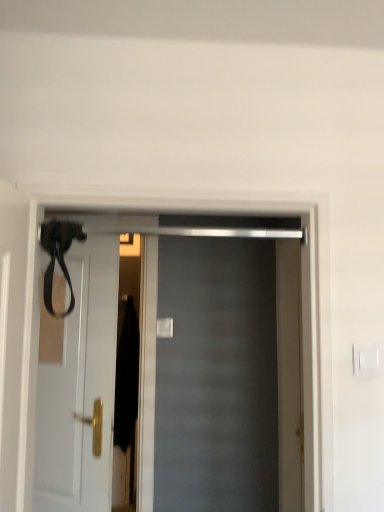
Find the location of a particular element. white matte door at left, which ranks as the second door in front-to-back order is located at coordinates (80, 388).

Measure the distance between point (74, 454) and camera.

Point (74, 454) and camera are 1.77 meters apart from each other.

Describe the element at coordinates (80, 388) in the screenshot. I see `white matte door at left, placed as the 1th door when sorted from left to right` at that location.

The height and width of the screenshot is (512, 384). What do you see at coordinates (178, 369) in the screenshot? I see `matte black door at center, which is counted as the second door, starting from the left` at bounding box center [178, 369].

Locate an element on the screen. Image resolution: width=384 pixels, height=512 pixels. matte black door at center, which is counted as the second door, starting from the left is located at coordinates (178, 369).

Locate an element on the screen. white matte door at left, the 1th door when ordered from back to front is located at coordinates (80, 388).

Between white matte door at left, placed as the 1th door when sorted from left to right, and matte black door at center, which is counted as the second door, starting from the left, which one appears on the right side from the viewer's perspective?

From the viewer's perspective, matte black door at center, which is counted as the second door, starting from the left, appears more on the right side.

Is white matte door at left, placed as the 1th door when sorted from left to right, closer to camera compared to matte black door at center, which is counted as the second door, starting from the left?

No, white matte door at left, placed as the 1th door when sorted from left to right, is behind matte black door at center, which is counted as the second door, starting from the left.

Considering the positions of point (110, 330) and point (99, 406), is point (110, 330) closer or farther from the camera than point (99, 406)?

Clearly, point (110, 330) is more distant from the camera than point (99, 406).

From the image's perspective, does white matte door at left, placed as the 1th door when sorted from left to right, appear lower than matte black door at center, positioned as the 1th door in front-to-back order?

Yes.

From a real-world perspective, is white matte door at left, the 1th door when ordered from back to front, above or below matte black door at center, positioned as the 1th door in front-to-back order?

From a real-world perspective, white matte door at left, the 1th door when ordered from back to front, is physically below matte black door at center, positioned as the 1th door in front-to-back order.

In the scene shown: Which of these two, white matte door at left, placed as the 1th door when sorted from left to right, or matte black door at center, arranged as the 2th door when viewed from the back, is thinner?

white matte door at left, placed as the 1th door when sorted from left to right, is thinner.

Considering the sizes of objects white matte door at left, placed as the 1th door when sorted from left to right, and matte black door at center, positioned as the 1th door in front-to-back order, in the image provided, who is taller, white matte door at left, placed as the 1th door when sorted from left to right, or matte black door at center, positioned as the 1th door in front-to-back order,?

With more height is white matte door at left, placed as the 1th door when sorted from left to right.

Considering the sizes of objects white matte door at left, the 1th door when ordered from back to front, and matte black door at center, which is the 1th door in right-to-left order, in the image provided, who is bigger, white matte door at left, the 1th door when ordered from back to front, or matte black door at center, which is the 1th door in right-to-left order,?

matte black door at center, which is the 1th door in right-to-left order.

From the picture: Can matte black door at center, which is counted as the second door, starting from the left, be found inside white matte door at left, placed as the 1th door when sorted from left to right?

That's incorrect, matte black door at center, which is counted as the second door, starting from the left, is not inside white matte door at left, placed as the 1th door when sorted from left to right.

Is white matte door at left, marked as the 2th door in a right-to-left arrangement, with matte black door at center, arranged as the 2th door when viewed from the back?

No, white matte door at left, marked as the 2th door in a right-to-left arrangement, is not beside matte black door at center, arranged as the 2th door when viewed from the back.

Could you tell me if white matte door at left, marked as the 2th door in a right-to-left arrangement, is facing matte black door at center, which is the 1th door in right-to-left order?

No, white matte door at left, marked as the 2th door in a right-to-left arrangement, does not turn towards matte black door at center, which is the 1th door in right-to-left order.

You are a GUI agent. You are given a task and a screenshot of the screen. Output one action in this format:
    pyautogui.click(x=<x>, y=<y>)
    Task: Click on the door above the white matte door at left, the 1th door when ordered from back to front (from a real-world perspective)
    
    Given the screenshot: What is the action you would take?
    pyautogui.click(x=178, y=369)

In the image, is matte black door at center, which is counted as the second door, starting from the left, on the left side or the right side of white matte door at left, which ranks as the second door in front-to-back order?

Based on their positions, matte black door at center, which is counted as the second door, starting from the left, is located to the right of white matte door at left, which ranks as the second door in front-to-back order.

From the picture: Is matte black door at center, which is the 1th door in right-to-left order, in front of white matte door at left, which ranks as the second door in front-to-back order?

That is True.

Considering the positions of point (149, 314) and point (113, 317), is point (149, 314) closer or farther from the camera than point (113, 317)?

Clearly, point (149, 314) is more distant from the camera than point (113, 317).

From the image's perspective, is matte black door at center, arranged as the 2th door when viewed from the back, beneath white matte door at left, which ranks as the second door in front-to-back order?

No, from the image's perspective, matte black door at center, arranged as the 2th door when viewed from the back, is not beneath white matte door at left, which ranks as the second door in front-to-back order.

From a real-world perspective, who is located lower, matte black door at center, which is counted as the second door, starting from the left, or white matte door at left, the 1th door when ordered from back to front?

From a 3D spatial view, white matte door at left, the 1th door when ordered from back to front, is below.

Which of these two, matte black door at center, which is the 1th door in right-to-left order, or white matte door at left, marked as the 2th door in a right-to-left arrangement, is wider?

matte black door at center, which is the 1th door in right-to-left order, is wider.

Consider the image. Between matte black door at center, which is the 1th door in right-to-left order, and white matte door at left, which ranks as the second door in front-to-back order, which one has more height?

Standing taller between the two is white matte door at left, which ranks as the second door in front-to-back order.

Between matte black door at center, arranged as the 2th door when viewed from the back, and white matte door at left, marked as the 2th door in a right-to-left arrangement, which one has larger size?

With larger size is matte black door at center, arranged as the 2th door when viewed from the back.

Could white matte door at left, marked as the 2th door in a right-to-left arrangement, be considered to be inside matte black door at center, positioned as the 1th door in front-to-back order?

Definitely not — white matte door at left, marked as the 2th door in a right-to-left arrangement, is not inside matte black door at center, positioned as the 1th door in front-to-back order.

Based on the photo, is matte black door at center, which is the 1th door in right-to-left order, in contact with white matte door at left, which ranks as the second door in front-to-back order?

There is a gap between matte black door at center, which is the 1th door in right-to-left order, and white matte door at left, which ranks as the second door in front-to-back order.

Does matte black door at center, which is the 1th door in right-to-left order, turn towards white matte door at left, which ranks as the second door in front-to-back order?

No.

How different are the orientations of matte black door at center, arranged as the 2th door when viewed from the back, and white matte door at left, the 1th door when ordered from back to front, in degrees?

28.6 degrees separate the facing orientations of matte black door at center, arranged as the 2th door when viewed from the back, and white matte door at left, the 1th door when ordered from back to front.

How far apart are matte black door at center, which is counted as the second door, starting from the left, and white matte door at left, marked as the 2th door in a right-to-left arrangement?

matte black door at center, which is counted as the second door, starting from the left, is 21.52 inches away from white matte door at left, marked as the 2th door in a right-to-left arrangement.

Locate an element on the screen. The height and width of the screenshot is (512, 384). door below the matte black door at center, arranged as the 2th door when viewed from the back (from the image's perspective) is located at coordinates (80, 388).

Where is `door below the matte black door at center, which is counted as the second door, starting from the left (from a real-world perspective)`? This screenshot has width=384, height=512. door below the matte black door at center, which is counted as the second door, starting from the left (from a real-world perspective) is located at coordinates (80, 388).

This screenshot has height=512, width=384. Find the location of `door located above the white matte door at left, the 1th door when ordered from back to front (from a real-world perspective)`. door located above the white matte door at left, the 1th door when ordered from back to front (from a real-world perspective) is located at coordinates (178, 369).